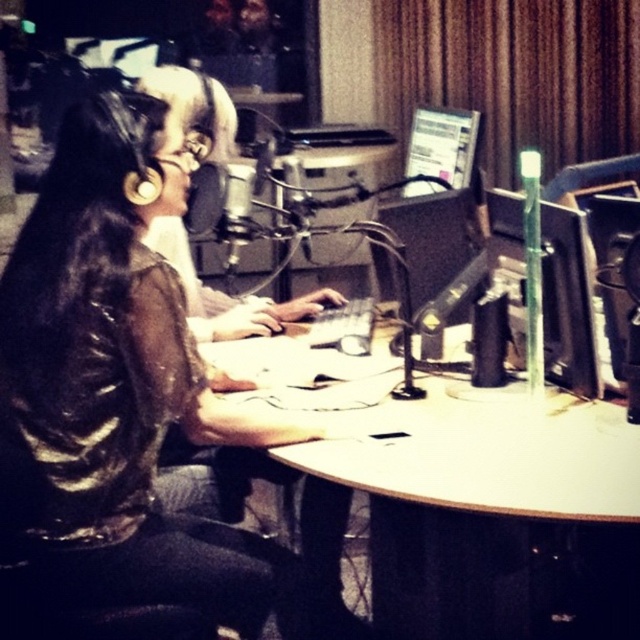
Question: Which object appears farthest from the camera in this image?

Choices:
 (A) white glossy computer desk at center
 (B) matte black shirt at center

Answer: (B)

Question: Which point appears closest to the camera in this image?

Choices:
 (A) (65, 508)
 (B) (497, 451)

Answer: (A)

Question: Which object is closer to the camera taking this photo?

Choices:
 (A) white glossy computer desk at center
 (B) matte black shirt at center

Answer: (A)

Question: Observing the image, what is the correct spatial positioning of matte black shirt at center in reference to white glossy computer desk at center?

Choices:
 (A) right
 (B) left

Answer: (B)

Question: Is matte black shirt at center positioned in front of white glossy computer desk at center?

Choices:
 (A) yes
 (B) no

Answer: (B)

Question: Can you confirm if matte black shirt at center is wider than white glossy computer desk at center?

Choices:
 (A) no
 (B) yes

Answer: (A)